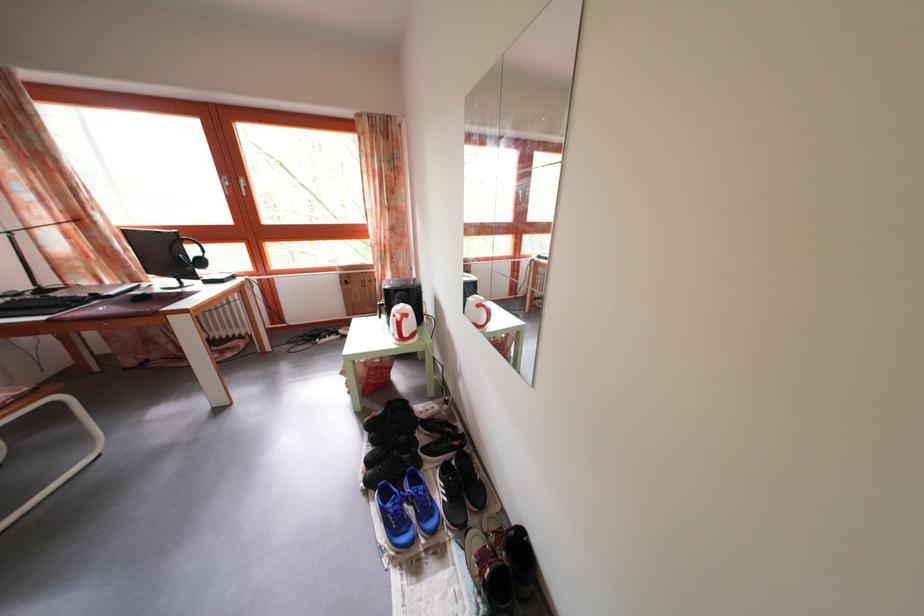
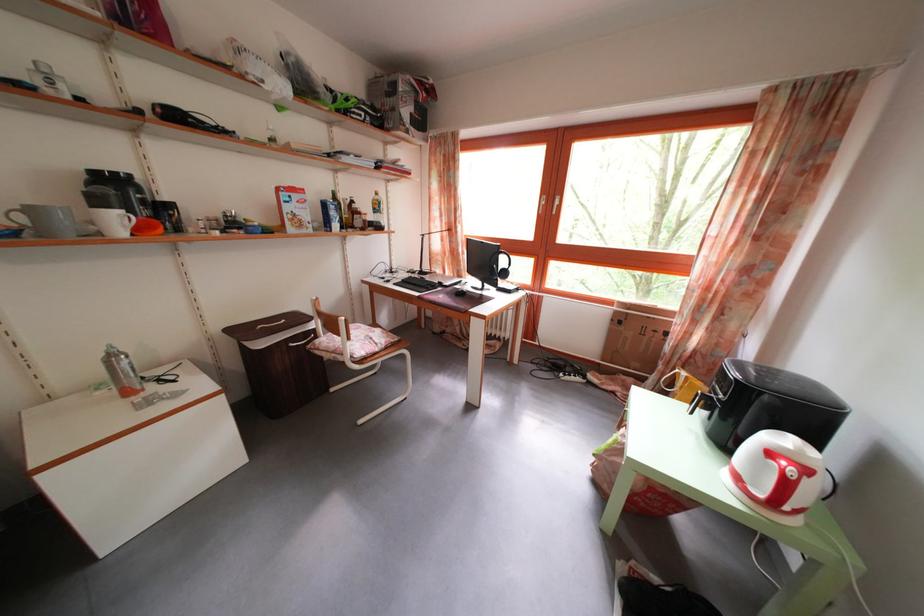
Question: How did the camera likely rotate?

Choices:
 (A) Left
 (B) Right
 (C) Up
 (D) Down

Answer: (A)